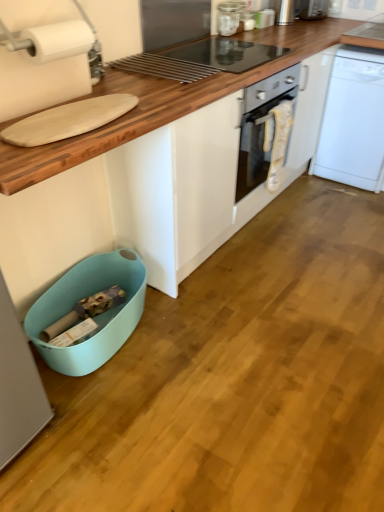
In order to face wooden cutting board at upper left, should I rotate leftwards or rightwards?

It's best to rotate right around 3.029 degrees.

What do you see at coordinates (57, 40) in the screenshot? The height and width of the screenshot is (512, 384). I see `white matte paper towel at upper left` at bounding box center [57, 40].

Where is `metallic silver toaster at upper center, marked as the 1th appliance in a front-to-back arrangement`? This screenshot has height=512, width=384. metallic silver toaster at upper center, marked as the 1th appliance in a front-to-back arrangement is located at coordinates (96, 63).

This screenshot has height=512, width=384. Describe the element at coordinates (95, 318) in the screenshot. I see `teal plastic dish washer at lower left` at that location.

In order to face clear glass jar at upper center, arranged as the fourth appliance when viewed from the top, should I rotate leftwards or rightwards?

Rotate your view right by about 4.771°.

How much space does metallic silver toaster at upper right, which is counted as the fourth appliance, starting from the front, occupy vertically?

metallic silver toaster at upper right, which is counted as the fourth appliance, starting from the front, is 6.56 inches in height.

At what (x,y) coordinates should I click in order to perform the action: click on satin silver toaster at upper right, which appears as the first appliance when viewed from the right. Please return your answer as a coordinate pair (x, y). The height and width of the screenshot is (512, 384). Looking at the image, I should click on (313, 9).

Which object is thinner, white plastic dishwasher at right or metallic silver toaster at upper right, the fourth appliance ordered from the bottom?

Thinner between the two is metallic silver toaster at upper right, the fourth appliance ordered from the bottom.

Is white plastic dishwasher at right shorter than metallic silver toaster at upper right, which is counted as the fourth appliance, starting from the front?

Incorrect, the height of white plastic dishwasher at right does not fall short of that of metallic silver toaster at upper right, which is counted as the fourth appliance, starting from the front.

Are white plastic dishwasher at right and metallic silver toaster at upper right, the fourth appliance when ordered from left to right, located far from each other?

No, white plastic dishwasher at right is not far from metallic silver toaster at upper right, the fourth appliance when ordered from left to right.

From the image's perspective, count 3rd appliances upward from the white plastic dishwasher at right and point to it. Please provide its 2D coordinates.

[(284, 12)]

Is teal plastic dish washer at lower left wider than clear glass jar at upper center, acting as the 4th appliance starting from the right?

Yes.

Is teal plastic dish washer at lower left bigger than clear glass jar at upper center, the 2th appliance in the left-to-right sequence?

Indeed, teal plastic dish washer at lower left has a larger size compared to clear glass jar at upper center, the 2th appliance in the left-to-right sequence.

Is teal plastic dish washer at lower left with clear glass jar at upper center, arranged as the fourth appliance when viewed from the top?

teal plastic dish washer at lower left is not next to clear glass jar at upper center, arranged as the fourth appliance when viewed from the top, and they're not touching.

Are satin silver toaster at upper right, the fifth appliance from the front, and metallic silver toaster at upper center, which is the 5th appliance in back-to-front order, making contact?

No, satin silver toaster at upper right, the fifth appliance from the front, is not next to metallic silver toaster at upper center, which is the 5th appliance in back-to-front order.

In the scene shown: From a real-world perspective, is satin silver toaster at upper right, arranged as the 5th appliance when ordered from the bottom, on top of metallic silver toaster at upper center, the 1th appliance in the left-to-right sequence?

Indeed, from a real-world perspective, satin silver toaster at upper right, arranged as the 5th appliance when ordered from the bottom, stands above metallic silver toaster at upper center, the 1th appliance in the left-to-right sequence.

Between satin silver toaster at upper right, which appears as the first appliance when viewed from the right, and metallic silver toaster at upper center, marked as the 1th appliance in a front-to-back arrangement, which one has more height?

Standing taller between the two is satin silver toaster at upper right, which appears as the first appliance when viewed from the right.

Is point (318, 17) closer to camera compared to point (91, 82)?

No.

Is metallic silver toaster at upper right, the fourth appliance when ordered from left to right, positioned in front of wooden cutting board at upper left?

No, metallic silver toaster at upper right, the fourth appliance when ordered from left to right, is further to the viewer.

From a real-world perspective, does metallic silver toaster at upper right, which is counted as the 2th appliance, starting from the right, sit lower than wooden cutting board at upper left?

No, from a real-world perspective, metallic silver toaster at upper right, which is counted as the 2th appliance, starting from the right, is not below wooden cutting board at upper left.

Can you confirm if metallic silver toaster at upper right, which is the second appliance from back to front, is positioned to the right of wooden cutting board at upper left?

Yes, metallic silver toaster at upper right, which is the second appliance from back to front, is to the right of wooden cutting board at upper left.

Is metallic silver toaster at upper right, the fourth appliance ordered from the bottom, facing towards wooden cutting board at upper left?

No.

Would you say wooden cutting board at upper left is part of teal plastic dish washer at lower left's contents?

No, wooden cutting board at upper left is not a part of teal plastic dish washer at lower left.

From the image's perspective, is teal plastic dish washer at lower left above wooden cutting board at upper left?

Actually, teal plastic dish washer at lower left appears below wooden cutting board at upper left in the image.

Where is `dish washer that appears behind the wooden cutting board at upper left`? dish washer that appears behind the wooden cutting board at upper left is located at coordinates (95, 318).

From a real-world perspective, is teal plastic dish washer at lower left physically below wooden cutting board at upper left?

Correct, in the physical world, teal plastic dish washer at lower left is lower than wooden cutting board at upper left.

From the image's perspective, is metallic silver toaster at upper right, which is counted as the fourth appliance, starting from the front, above satin silver toaster at upper right, arranged as the 5th appliance when ordered from the bottom?

Actually, metallic silver toaster at upper right, which is counted as the fourth appliance, starting from the front, appears below satin silver toaster at upper right, arranged as the 5th appliance when ordered from the bottom, in the image.

Is metallic silver toaster at upper right, which is the second appliance from back to front, to the left or to the right of satin silver toaster at upper right, which is the first appliance from top to bottom, in the image?

metallic silver toaster at upper right, which is the second appliance from back to front, is to the left of satin silver toaster at upper right, which is the first appliance from top to bottom.

From a real-world perspective, who is located lower, metallic silver toaster at upper right, the fourth appliance ordered from the bottom, or satin silver toaster at upper right, marked as the 1th appliance in a back-to-front arrangement?

metallic silver toaster at upper right, the fourth appliance ordered from the bottom, is physically lower.

Considering the sizes of objects metallic silver toaster at upper right, which ranks as the 2th appliance in top-to-bottom order, and satin silver toaster at upper right, which is the first appliance from top to bottom, in the image provided, who is smaller, metallic silver toaster at upper right, which ranks as the 2th appliance in top-to-bottom order, or satin silver toaster at upper right, which is the first appliance from top to bottom,?

metallic silver toaster at upper right, which ranks as the 2th appliance in top-to-bottom order.

Consider the image. Between metallic silver toaster at upper right, which is counted as the 2th appliance, starting from the right, and teal plastic dish washer at lower left, which one has less height?

With less height is metallic silver toaster at upper right, which is counted as the 2th appliance, starting from the right.

Who is more distant, metallic silver toaster at upper right, which ranks as the 2th appliance in top-to-bottom order, or teal plastic dish washer at lower left?

metallic silver toaster at upper right, which ranks as the 2th appliance in top-to-bottom order, is further away from the camera.

Considering the positions of point (277, 1) and point (70, 307), is point (277, 1) closer or farther from the camera than point (70, 307)?

Point (277, 1) is positioned farther from the camera compared to point (70, 307).

Are metallic silver toaster at upper right, which ranks as the 2th appliance in top-to-bottom order, and teal plastic dish washer at lower left far apart?

Absolutely, metallic silver toaster at upper right, which ranks as the 2th appliance in top-to-bottom order, is distant from teal plastic dish washer at lower left.

In order to click on appliance that is the 4th one above the white plastic dishwasher at right (from a real-world perspective) in this screenshot , I will do `click(284, 12)`.

Starting from the teal plastic dish washer at lower left, which appliance is the 2nd one behind? Please provide its 2D coordinates.

[(229, 17)]

Considering their positions, is wooden cutting board at upper left positioned closer to white matte paper towel at upper left than white plastic dishwasher at right?

wooden cutting board at upper left.

Which object lies nearer to the anchor point metallic silver toaster at upper center, the 3th appliance when ordered from top to bottom, metallic silver toaster at upper right, the fourth appliance when ordered from left to right, or wooden cutting board at upper left?

metallic silver toaster at upper right, the fourth appliance when ordered from left to right, is positioned closer to the anchor metallic silver toaster at upper center, the 3th appliance when ordered from top to bottom.

Based on their spatial positions, is white matte paper towel at upper left or white plastic dishwasher at right closer to wooden cutting board at upper left?

The object closer to wooden cutting board at upper left is white matte paper towel at upper left.

Based on their spatial positions, is satin silver toaster at upper right, marked as the 1th appliance in a back-to-front arrangement, or clear glass jar at upper center, arranged as the fourth appliance when viewed from the top, further from white plastic dishwasher at right?

The object further to white plastic dishwasher at right is clear glass jar at upper center, arranged as the fourth appliance when viewed from the top.

From the image, which object appears to be nearer to metallic silver toaster at upper right, which is counted as the 2th appliance, starting from the right, metallic silver toaster at upper center, the 1th appliance when ordered from bottom to top, or clear glass jar at upper center, the second appliance from the front?

Among the two, clear glass jar at upper center, the second appliance from the front, is located nearer to metallic silver toaster at upper right, which is counted as the 2th appliance, starting from the right.

Which object lies further to the anchor point metallic silver toaster at upper center, which appears as the third appliance when viewed from the front, white plastic dishwasher at right or wooden cutting board at upper left?

wooden cutting board at upper left is further to metallic silver toaster at upper center, which appears as the third appliance when viewed from the front.

Considering their positions, is wooden cutting board at upper left positioned closer to satin silver toaster at upper right, arranged as the 5th appliance when ordered from the bottom, than clear glass jar at upper center, the 2th appliance in the left-to-right sequence?

clear glass jar at upper center, the 2th appliance in the left-to-right sequence, is closer to satin silver toaster at upper right, arranged as the 5th appliance when ordered from the bottom.

Which object lies nearer to the anchor point satin silver toaster at upper right, arranged as the 5th appliance when ordered from the bottom, clear glass jar at upper center, the second appliance from the front, or white plastic dishwasher at right?

The object closer to satin silver toaster at upper right, arranged as the 5th appliance when ordered from the bottom, is clear glass jar at upper center, the second appliance from the front.

Where is `paper towel between metallic silver toaster at upper center, which is the 5th appliance in back-to-front order, and teal plastic dish washer at lower left vertically`? Image resolution: width=384 pixels, height=512 pixels. paper towel between metallic silver toaster at upper center, which is the 5th appliance in back-to-front order, and teal plastic dish washer at lower left vertically is located at coordinates (57, 40).

I want to click on appliance between metallic silver toaster at upper center, marked as the 1th appliance in a front-to-back arrangement, and metallic silver toaster at upper center, positioned as the third appliance in right-to-left order, from front to back, so coord(229,17).

The width and height of the screenshot is (384, 512). Find the location of `countertop between clear glass jar at upper center, arranged as the fourth appliance when viewed from the top, and teal plastic dish washer at lower left from top to bottom`. countertop between clear glass jar at upper center, arranged as the fourth appliance when viewed from the top, and teal plastic dish washer at lower left from top to bottom is located at coordinates (186, 154).

Locate an element on the screen. paper towel positioned between wooden cutting board at upper left and clear glass jar at upper center, the 2th appliance in the left-to-right sequence, from near to far is located at coordinates (57, 40).